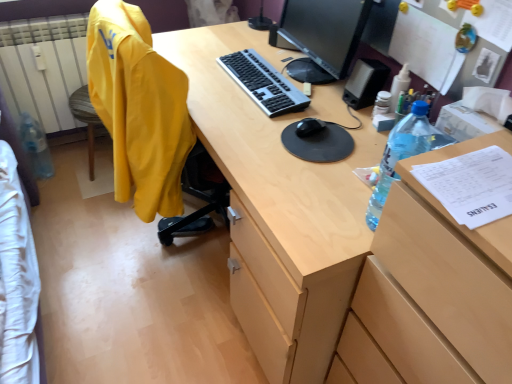
This screenshot has height=384, width=512. I want to click on blank area beneath black glossy monitor at upper center (from a real-world perspective), so click(x=309, y=69).